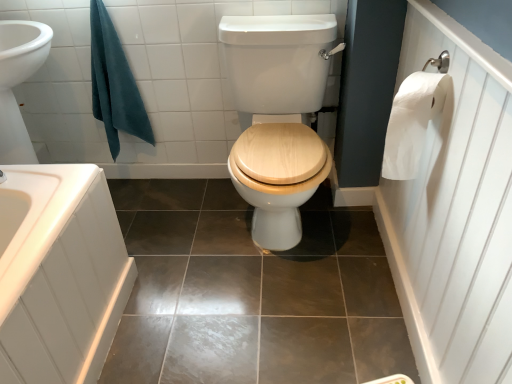
Question: From the image's perspective, would you say shiny brown tile at center is shown under teal cotton towel at upper left?

Choices:
 (A) yes
 (B) no

Answer: (A)

Question: Can you confirm if shiny brown tile at center is shorter than teal cotton towel at upper left?

Choices:
 (A) yes
 (B) no

Answer: (A)

Question: Is shiny brown tile at center positioned with its back to teal cotton towel at upper left?

Choices:
 (A) no
 (B) yes

Answer: (A)

Question: From a real-world perspective, is shiny brown tile at center positioned under teal cotton towel at upper left based on gravity?

Choices:
 (A) no
 (B) yes

Answer: (B)

Question: Is shiny brown tile at center positioned in front of teal cotton towel at upper left?

Choices:
 (A) yes
 (B) no

Answer: (A)

Question: From the image's perspective, is teal cotton towel at upper left above or below shiny brown tile at center?

Choices:
 (A) below
 (B) above

Answer: (B)

Question: Considering the positions of teal cotton towel at upper left and shiny brown tile at center in the image, is teal cotton towel at upper left wider or thinner than shiny brown tile at center?

Choices:
 (A) wide
 (B) thin

Answer: (B)

Question: From a real-world perspective, relative to shiny brown tile at center, is teal cotton towel at upper left vertically above or below?

Choices:
 (A) below
 (B) above

Answer: (B)

Question: Is teal cotton towel at upper left in front of or behind shiny brown tile at center in the image?

Choices:
 (A) behind
 (B) front

Answer: (A)

Question: Considering the positions of point (284, 200) and point (148, 124), is point (284, 200) closer or farther from the camera than point (148, 124)?

Choices:
 (A) farther
 (B) closer

Answer: (B)

Question: In the image, is white wood toilet seat at center on the left side or the right side of teal cotton towel at upper left?

Choices:
 (A) right
 (B) left

Answer: (A)

Question: From a real-world perspective, relative to teal cotton towel at upper left, is white wood toilet seat at center vertically above or below?

Choices:
 (A) below
 (B) above

Answer: (A)

Question: From the image's perspective, is white wood toilet seat at center located above or below teal cotton towel at upper left?

Choices:
 (A) above
 (B) below

Answer: (B)

Question: Considering the positions of teal cotton towel at upper left and white paper at right in the image, is teal cotton towel at upper left taller or shorter than white paper at right?

Choices:
 (A) tall
 (B) short

Answer: (A)

Question: From a real-world perspective, is teal cotton towel at upper left positioned above or below white paper at right?

Choices:
 (A) above
 (B) below

Answer: (B)